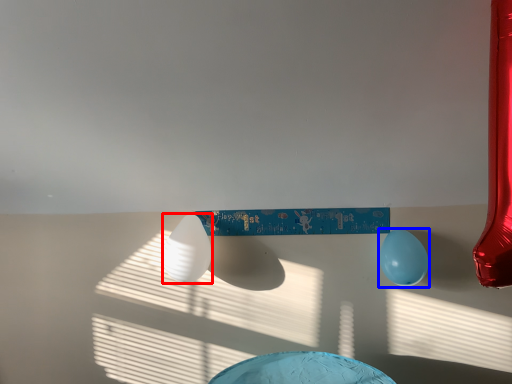
Question: Which point is further to the camera, balloon (highlighted by a red box) or balloon (highlighted by a blue box)?

Choices:
 (A) balloon
 (B) balloon

Answer: (B)